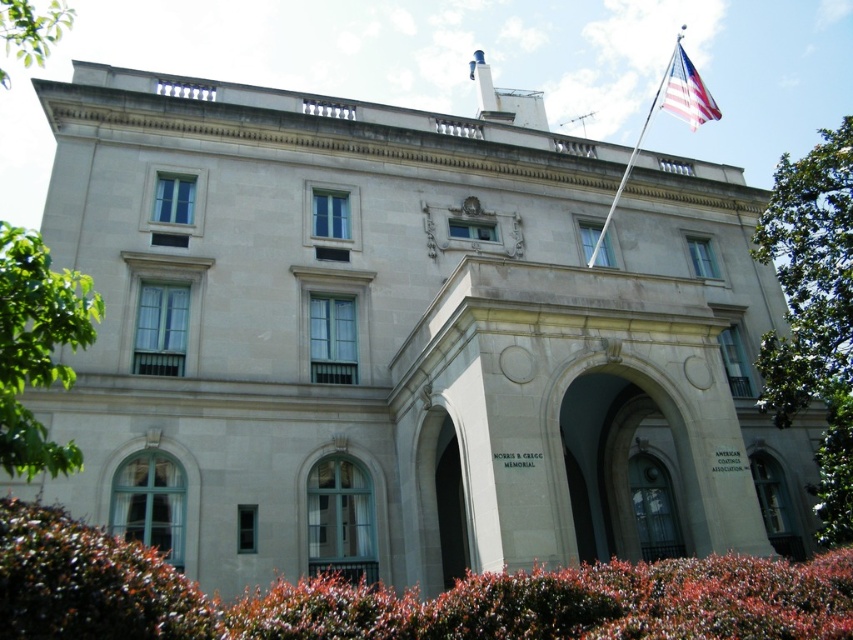
Question: Does green leafy bush at lower left have a greater width compared to polished silver flag pole at upper right?

Choices:
 (A) yes
 (B) no

Answer: (B)

Question: Is american flag at upper right bigger than polished silver flag pole at upper right?

Choices:
 (A) no
 (B) yes

Answer: (A)

Question: Where is green leafy bush at right located in relation to green leafy bush at lower left in the image?

Choices:
 (A) below
 (B) above

Answer: (B)

Question: Estimate the real-world distances between objects in this image. Which object is closer to the green leafy bush at lower left?

Choices:
 (A) polished silver flag pole at upper right
 (B) green leafy bush at right
 (C) american flag at upper right
 (D) green leafy hedge at lower left

Answer: (D)

Question: Which point appears closest to the camera in this image?

Choices:
 (A) (770, 228)
 (B) (717, 116)
 (C) (680, 56)
 (D) (33, 605)

Answer: (D)

Question: Which object appears closest to the camera in this image?

Choices:
 (A) green leafy bush at lower left
 (B) american flag at upper right

Answer: (A)